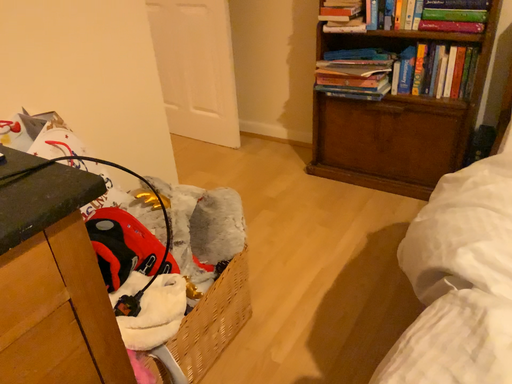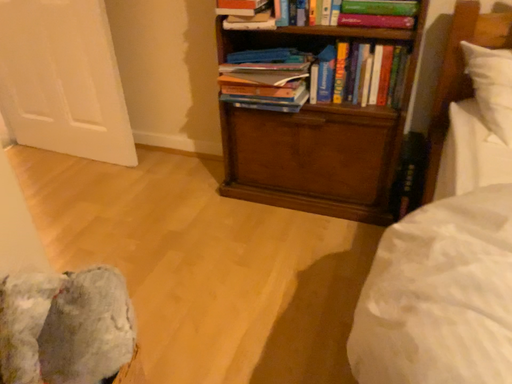
Question: Which way did the camera rotate in the video?

Choices:
 (A) rotated left
 (B) rotated right

Answer: (B)